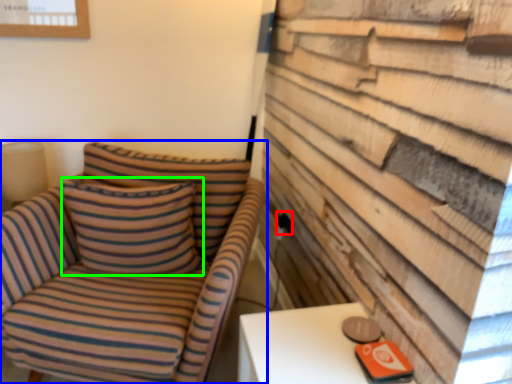
Question: Which is nearer to the electric outlet (highlighted by a red box)? chair (highlighted by a blue box) or pillow (highlighted by a green box).

Choices:
 (A) chair
 (B) pillow

Answer: (B)